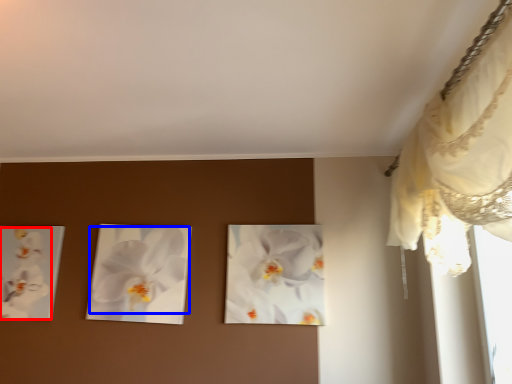
Question: Among these objects, which one is nearest to the camera, flower (highlighted by a red box) or flower (highlighted by a blue box)?

Choices:
 (A) flower
 (B) flower

Answer: (B)